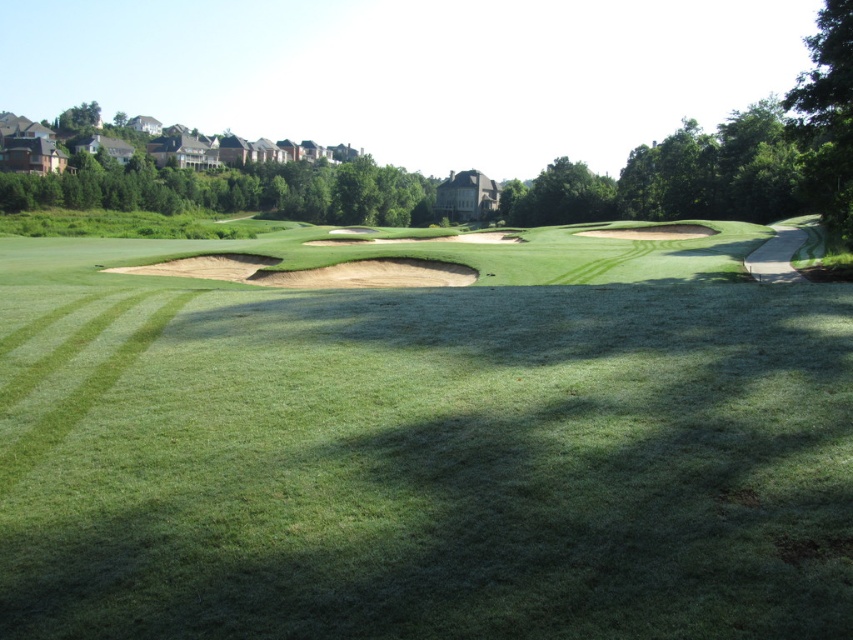
Question: Which point appears closest to the camera in this image?

Choices:
 (A) (293, 284)
 (B) (670, 355)

Answer: (B)

Question: Is green grassy golf course at center to the left of brown sand bunker at center from the viewer's perspective?

Choices:
 (A) no
 (B) yes

Answer: (A)

Question: Observing the image, what is the correct spatial positioning of green grassy golf course at center in reference to brown sand bunker at center?

Choices:
 (A) below
 (B) above

Answer: (A)

Question: Does green grassy golf course at center have a larger size compared to brown sand bunker at center?

Choices:
 (A) yes
 (B) no

Answer: (A)